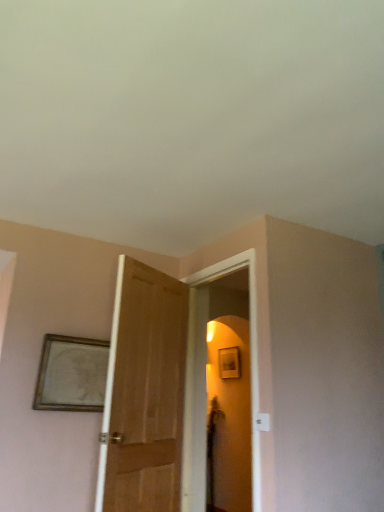
You are a GUI agent. You are given a task and a screenshot of the screen. Output one action in this format:
    pyautogui.click(x=<x>, y=<y>)
    Task: Click on the matte wooden screen door at center
    This screenshot has height=512, width=384.
    Given the screenshot: What is the action you would take?
    pyautogui.click(x=250, y=347)

What do you see at coordinates (250, 347) in the screenshot?
I see `matte wooden screen door at center` at bounding box center [250, 347].

Measure the distance between point [251,400] and camera.

They are 12.38 feet apart.

Describe the element at coordinates (71, 374) in the screenshot. I see `wooden framed drawing at upper left` at that location.

At what (x,y) coordinates should I click in order to perform the action: click on wooden framed drawing at upper left. Please return your answer as a coordinate pair (x, y). This screenshot has height=512, width=384. Looking at the image, I should click on (71, 374).

Where is `matte wooden screen door at center`? matte wooden screen door at center is located at coordinates (250, 347).

Looking at this image, which is more to the right, wooden framed drawing at upper left or matte wooden screen door at center?

From the viewer's perspective, matte wooden screen door at center appears more on the right side.

Which is in front, wooden framed drawing at upper left or matte wooden screen door at center?

Positioned in front is matte wooden screen door at center.

Which is in front, point (88, 350) or point (255, 452)?

The point (255, 452) is more forward.

From the image's perspective, which object appears higher, wooden framed drawing at upper left or matte wooden screen door at center?

wooden framed drawing at upper left appears higher in the image.

Based on the photo, from a real-world perspective, is wooden framed drawing at upper left above or below matte wooden screen door at center?

In terms of real-world spatial position, wooden framed drawing at upper left is above matte wooden screen door at center.

Which object is wider, wooden framed drawing at upper left or matte wooden screen door at center?

Wider between the two is matte wooden screen door at center.

In the scene shown: Considering the sizes of objects wooden framed drawing at upper left and matte wooden screen door at center in the image provided, who is shorter, wooden framed drawing at upper left or matte wooden screen door at center?

With less height is wooden framed drawing at upper left.

From the picture: Is wooden framed drawing at upper left bigger or smaller than matte wooden screen door at center?

In the image, wooden framed drawing at upper left appears to be smaller than matte wooden screen door at center.

Would you say wooden framed drawing at upper left contains matte wooden screen door at center?

No, matte wooden screen door at center is not a part of wooden framed drawing at upper left.

Does wooden framed drawing at upper left touch matte wooden screen door at center?

Result: No.

Is wooden framed drawing at upper left facing away from matte wooden screen door at center?

No.

How different are the orientations of wooden framed drawing at upper left and matte wooden screen door at center in degrees?

wooden framed drawing at upper left and matte wooden screen door at center are facing 93.1 degrees away from each other.

The height and width of the screenshot is (512, 384). I want to click on picture frame above the matte wooden screen door at center (from a real-world perspective), so click(x=71, y=374).

In the image, is matte wooden screen door at center on the left side or the right side of wooden framed drawing at upper left?

matte wooden screen door at center is positioned on wooden framed drawing at upper left's right side.

Is matte wooden screen door at center closer to the viewer compared to wooden framed drawing at upper left?

Yes, it is.

Between point (252, 506) and point (99, 371), which one is positioned in front?

The point (252, 506) is closer.

From the image's perspective, is matte wooden screen door at center located above or below wooden framed drawing at upper left?

Based on their image positions, matte wooden screen door at center is located beneath wooden framed drawing at upper left.

From a real-world perspective, which object stands above the other?

wooden framed drawing at upper left is physically above.

Considering the relative sizes of matte wooden screen door at center and wooden framed drawing at upper left in the image provided, is matte wooden screen door at center wider than wooden framed drawing at upper left?

Yes, matte wooden screen door at center is wider than wooden framed drawing at upper left.

Who is taller, matte wooden screen door at center or wooden framed drawing at upper left?

matte wooden screen door at center.

Is matte wooden screen door at center smaller than wooden framed drawing at upper left?

No, matte wooden screen door at center is not smaller than wooden framed drawing at upper left.

Would you say wooden framed drawing at upper left is part of matte wooden screen door at center's contents?

That's incorrect, wooden framed drawing at upper left is not inside matte wooden screen door at center.

Would you consider matte wooden screen door at center to be distant from wooden framed drawing at upper left?

No, matte wooden screen door at center is not far from wooden framed drawing at upper left.

Is matte wooden screen door at center positioned with its back to wooden framed drawing at upper left?

matte wooden screen door at center is not turned away from wooden framed drawing at upper left.

Can you tell me how much matte wooden screen door at center and wooden framed drawing at upper left differ in facing direction?

93.1 degrees separate the facing orientations of matte wooden screen door at center and wooden framed drawing at upper left.

Locate an element on the screen. picture frame behind the matte wooden screen door at center is located at coordinates (71, 374).

This screenshot has height=512, width=384. What are the coordinates of `picture frame above the matte wooden screen door at center (from the image's perspective)` in the screenshot? It's located at (71, 374).

Identify the location of picture frame on the left of matte wooden screen door at center. This screenshot has width=384, height=512. (71, 374).